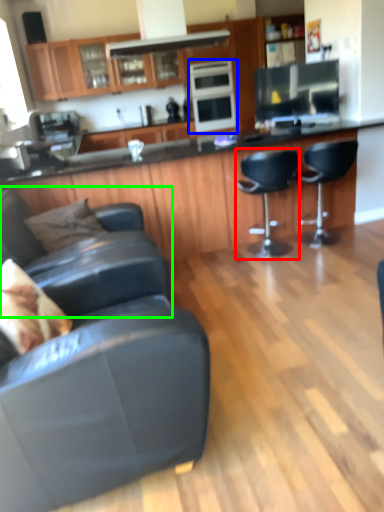
Question: Based on their relative distances, which object is nearer to chair (highlighted by a red box)? Choose from appliance (highlighted by a blue box) and chair (highlighted by a green box).

Choices:
 (A) appliance
 (B) chair

Answer: (A)